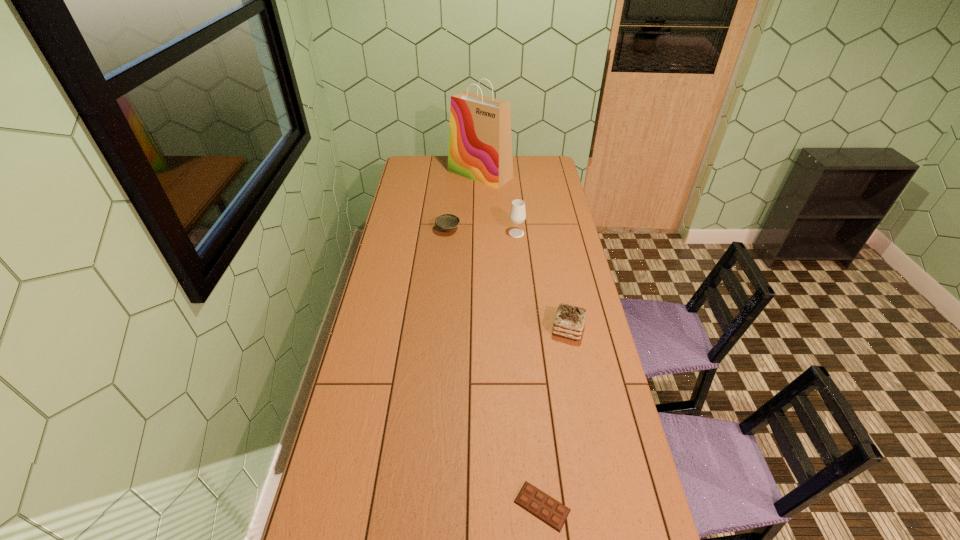
You are a GUI agent. You are given a task and a screenshot of the screen. Output one action in this format:
    pyautogui.click(x=<x>, y=<y>)
    Task: Click on the free spot located on the front of the third shortest object
    The width and height of the screenshot is (960, 540).
    Given the screenshot: What is the action you would take?
    pyautogui.click(x=579, y=384)

I want to click on free region located 0.170m on the right of the bowl, so click(495, 230).

Locate an element on the screen. The width and height of the screenshot is (960, 540). vacant space located 0.160m on the back of the nearest object is located at coordinates (535, 429).

Find the location of a particular element. The image size is (960, 540). object that is at the far edge is located at coordinates click(480, 144).

Find the location of a particular element. The height and width of the screenshot is (540, 960). object that is at the right edge is located at coordinates (569, 321).

In the image, there is a desktop. Where is `blank space at the far edge`? This screenshot has height=540, width=960. blank space at the far edge is located at coordinates (524, 172).

In the image, there is a desktop. At what (x,y) coordinates should I click in order to perform the action: click on vacant space at the left edge. Please return your answer as a coordinate pair (x, y). The width and height of the screenshot is (960, 540). Looking at the image, I should click on (356, 355).

This screenshot has height=540, width=960. Find the location of `free space at the right edge of the desktop`. free space at the right edge of the desktop is located at coordinates (546, 202).

In the image, there is a desktop. Identify the location of free space at the far right corner. (554, 159).

The width and height of the screenshot is (960, 540). I want to click on blank region between the shopping bag and the glass, so click(x=498, y=204).